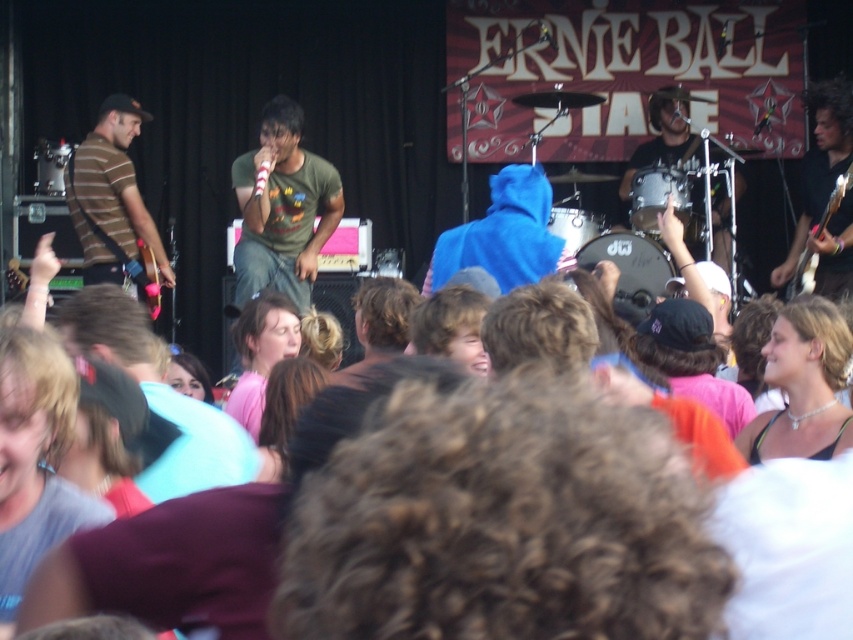
Describe the element at coordinates (114, 204) in the screenshot. This screenshot has height=640, width=853. I see `striped jersey guitar at left` at that location.

Does striped jersey guitar at left have a smaller size compared to matte black drum set at right?

Actually, striped jersey guitar at left might be larger than matte black drum set at right.

What are the coordinates of `striped jersey guitar at left` in the screenshot? It's located at (114, 204).

Between green matte t-shirt at center and wooden electric guitar at right, which one is positioned lower?

wooden electric guitar at right is below.

Who is more forward, (302,172) or (834,209)?

Positioned in front is point (834,209).

Find the location of a particular element. green matte t-shirt at center is located at coordinates (282, 208).

Does pink fabric at center come behind matte black drum set at right?

No.

Does pink fabric at center have a smaller size compared to matte black drum set at right?

Indeed, pink fabric at center has a smaller size compared to matte black drum set at right.

Does point (280, 339) lie behind point (698, 150)?

That is False.

In order to click on pink fabric at center in this screenshot , I will do `click(260, 353)`.